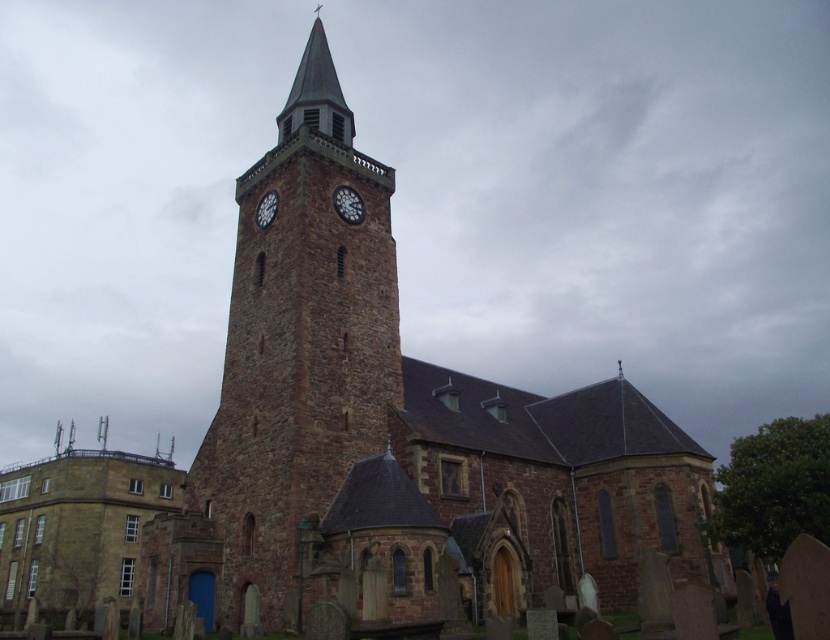
Question: Does brown stone church at center have a smaller size compared to brown stone clock tower at center?

Choices:
 (A) yes
 (B) no

Answer: (B)

Question: Does dark brown wooden clock at center appear over matte brown clock at upper center?

Choices:
 (A) no
 (B) yes

Answer: (A)

Question: Which of the following is the farthest from the observer?

Choices:
 (A) matte brown clock at upper center
 (B) brown stone clock tower at center
 (C) brown stone church at center

Answer: (A)

Question: Estimate the real-world distances between objects in this image. Which object is closer to the matte brown clock at upper center?

Choices:
 (A) dark brown wooden clock at center
 (B) brown stone clock tower at center
 (C) brown stone church at center

Answer: (A)

Question: Is brown stone clock tower at center positioned in front of matte brown clock at upper center?

Choices:
 (A) yes
 (B) no

Answer: (A)

Question: Which point is farther from the camera taking this photo?

Choices:
 (A) (269, 205)
 (B) (221, 404)

Answer: (A)